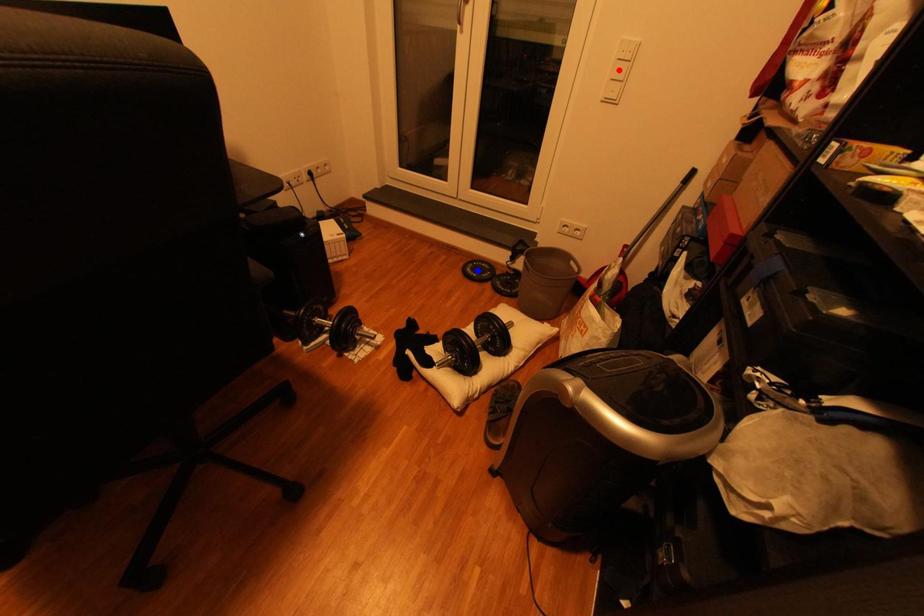
Question: Which of the two points in the image is closer to the camera?

Choices:
 (A) Blue point is closer.
 (B) Red point is closer.

Answer: (B)